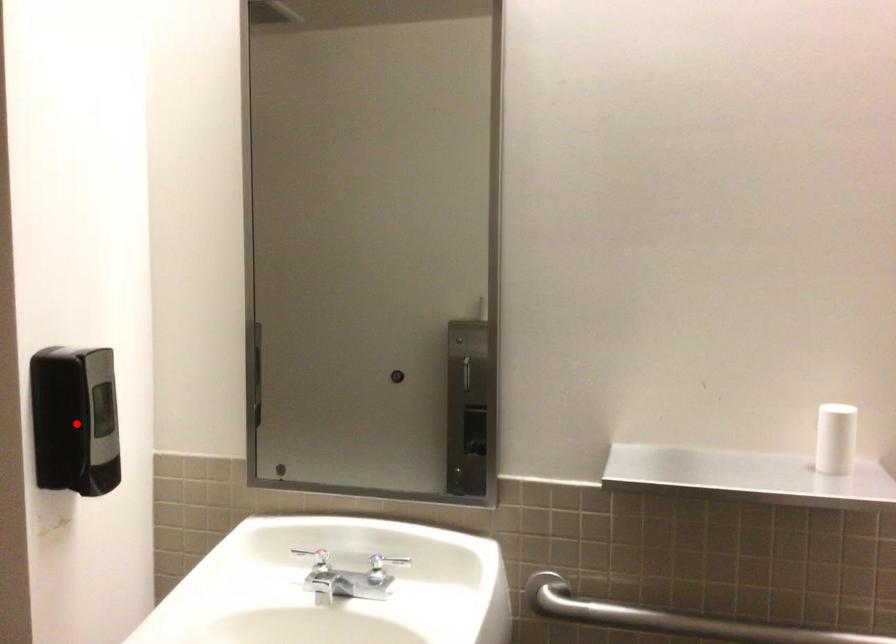
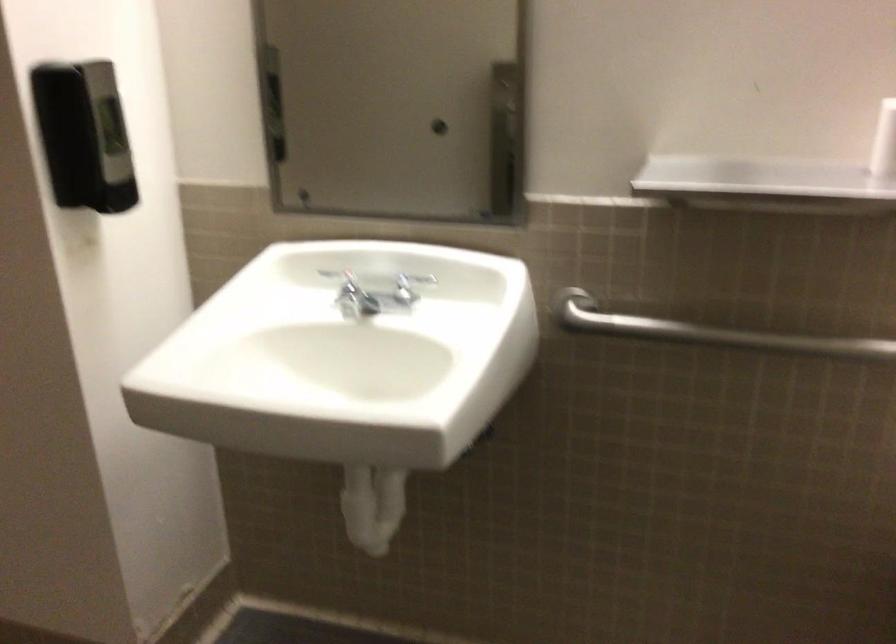
Question: I am providing you with two images of the same scene from different viewpoints. A red point is marked on the first image. Can you still see the location of the red point in image 2?

Choices:
 (A) Yes
 (B) No

Answer: (A)